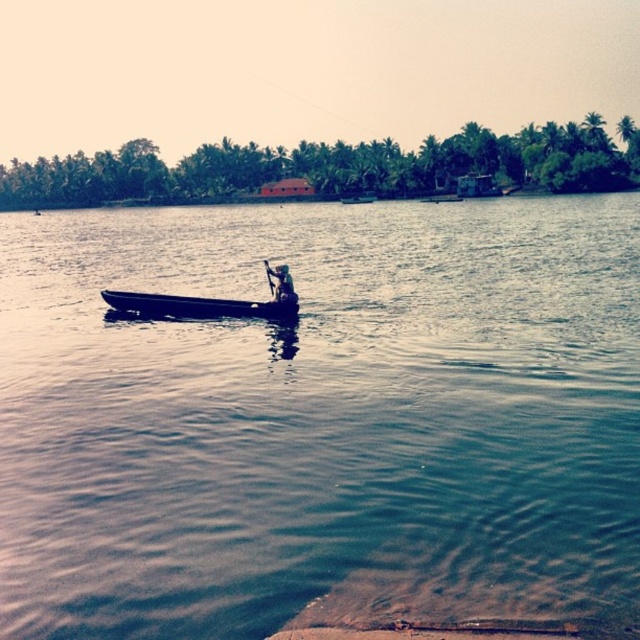
Question: Can you confirm if clear blue water at center is smaller than dark blue fabric boat at center?

Choices:
 (A) yes
 (B) no

Answer: (B)

Question: Is smooth dark wood canoe at center further to camera compared to wooden paddle at center?

Choices:
 (A) no
 (B) yes

Answer: (A)

Question: Does clear blue water at center appear on the left side of smooth dark wood canoe at center?

Choices:
 (A) no
 (B) yes

Answer: (B)

Question: Which of the following is the farthest from the observer?

Choices:
 (A) smooth dark wood canoe at center
 (B) dark blue fabric boat at center
 (C) wooden paddle at center
 (D) clear blue water at center

Answer: (C)

Question: Which point is closer to the camera?

Choices:
 (A) wooden paddle at center
 (B) smooth dark wood canoe at center
 (C) dark blue fabric boat at center
 (D) clear blue water at center

Answer: (D)

Question: Which object is farther from the camera taking this photo?

Choices:
 (A) wooden paddle at center
 (B) dark blue fabric boat at center
 (C) clear blue water at center

Answer: (A)